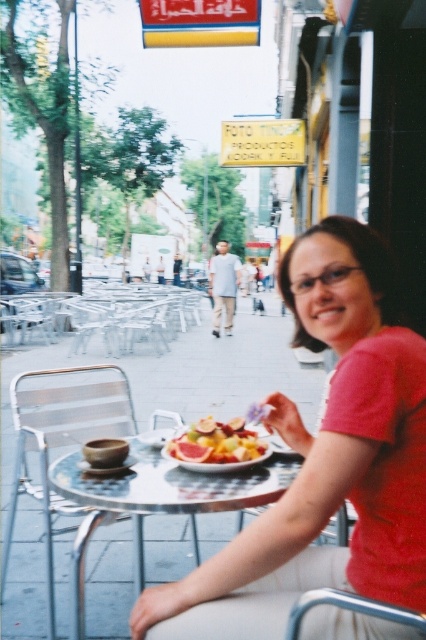
Between silver metallic chair at lower left and clear glass table at center, which one is positioned lower?

silver metallic chair at lower left

Does silver metallic chair at lower left have a lesser height compared to clear glass table at center?

No, silver metallic chair at lower left is not shorter than clear glass table at center.

Who is more forward, (97, 417) or (196, 509)?

Point (196, 509) is more forward.

Locate an element on the screen. silver metallic chair at lower left is located at coordinates (63, 448).

What do you see at coordinates (325, 458) in the screenshot? This screenshot has height=640, width=426. I see `matte red shirt at center` at bounding box center [325, 458].

Between point (379, 563) and point (186, 442), which one is positioned behind?

The point (186, 442) is behind.

At what (x,y) coordinates should I click in order to perform the action: click on matte red shirt at center. Please return your answer as a coordinate pair (x, y). Looking at the image, I should click on (325, 458).

Between clear glass table at center and juicy pink grapefruit at center, which one is positioned higher?

juicy pink grapefruit at center is higher up.

Between clear glass table at center and juicy pink grapefruit at center, which one is positioned lower?

clear glass table at center is lower down.

The height and width of the screenshot is (640, 426). Identify the location of clear glass table at center. (172, 490).

Find the location of `clear glass table at center`. clear glass table at center is located at coordinates (172, 490).